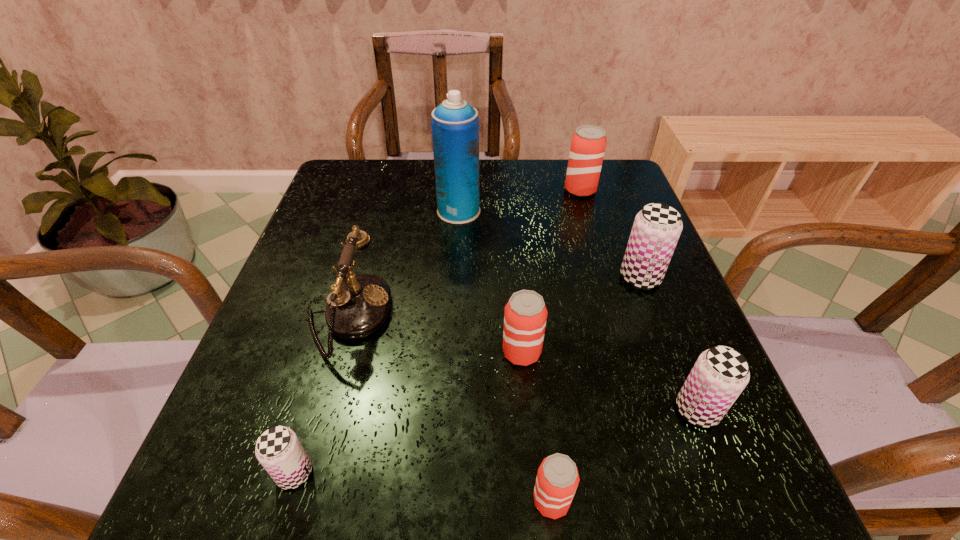
This screenshot has width=960, height=540. Identify the location of vacant point at the left edge. (266, 388).

Locate an element on the screen. This screenshot has height=540, width=960. blank space at the far left corner of the desktop is located at coordinates (383, 190).

In the image, there is a desktop. Where is `vacant space at the near right corner`? The width and height of the screenshot is (960, 540). vacant space at the near right corner is located at coordinates (741, 478).

I want to click on free area in between the smallest orange beer can and the second farthest beer can, so click(x=596, y=389).

Locate an element on the screen. free space between the tallest object and the farthest purple beer can is located at coordinates [549, 244].

Where is `free point between the farthest beer can and the tallest object`? This screenshot has height=540, width=960. free point between the farthest beer can and the tallest object is located at coordinates (519, 200).

The width and height of the screenshot is (960, 540). In order to click on free spot between the fifth nearest beer can and the smallest orange beer can in this screenshot , I will do `click(596, 389)`.

Where is `empty space that is in between the second farthest orange beer can and the farthest purple beer can`? The image size is (960, 540). empty space that is in between the second farthest orange beer can and the farthest purple beer can is located at coordinates (581, 315).

You are a GUI agent. You are given a task and a screenshot of the screen. Output one action in this format:
    pyautogui.click(x=<x>, y=<y>)
    Task: Click on the vacant point located between the smallest orange beer can and the second biggest orange beer can
    The width and height of the screenshot is (960, 540).
    Given the screenshot: What is the action you would take?
    pyautogui.click(x=537, y=426)

I want to click on empty location between the black telephone and the farthest beer can, so 464,253.